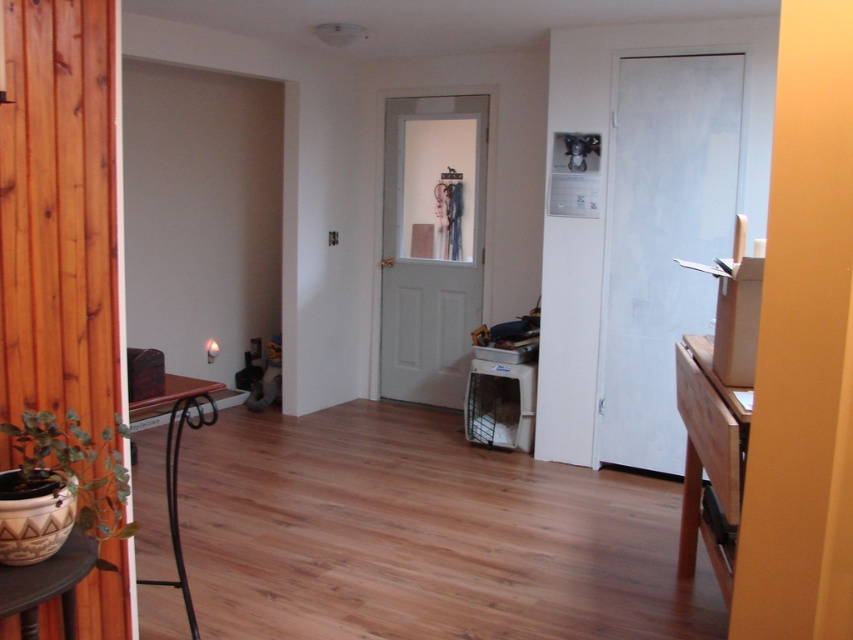
Is light brown wood table at right positioned at the back of matte plastic stool at lower center?

No, it is not.

Where is `light brown wood table at right`? light brown wood table at right is located at coordinates (709, 460).

Between light brown wood table at right and brown matte hardwood at left, which one is positioned lower?

brown matte hardwood at left is below.

Which of these two, light brown wood table at right or brown matte hardwood at left, stands taller?

With more height is light brown wood table at right.

Is point (717, 579) closer to viewer compared to point (198, 412)?

Yes, point (717, 579) is in front of point (198, 412).

You are a GUI agent. You are given a task and a screenshot of the screen. Output one action in this format:
    pyautogui.click(x=<x>, y=<y>)
    Task: Click on the light brown wood table at right
    
    Given the screenshot: What is the action you would take?
    pyautogui.click(x=709, y=460)

Does brown matte hardwood at left appear on the right side of matte plastic stool at lower center?

In fact, brown matte hardwood at left is to the left of matte plastic stool at lower center.

The height and width of the screenshot is (640, 853). What are the coordinates of `brown matte hardwood at left` in the screenshot? It's located at (177, 454).

In the scene shown: Who is more forward, (190, 616) or (474, 442)?

Point (190, 616) is in front.

The height and width of the screenshot is (640, 853). Identify the location of brown matte hardwood at left. (177, 454).